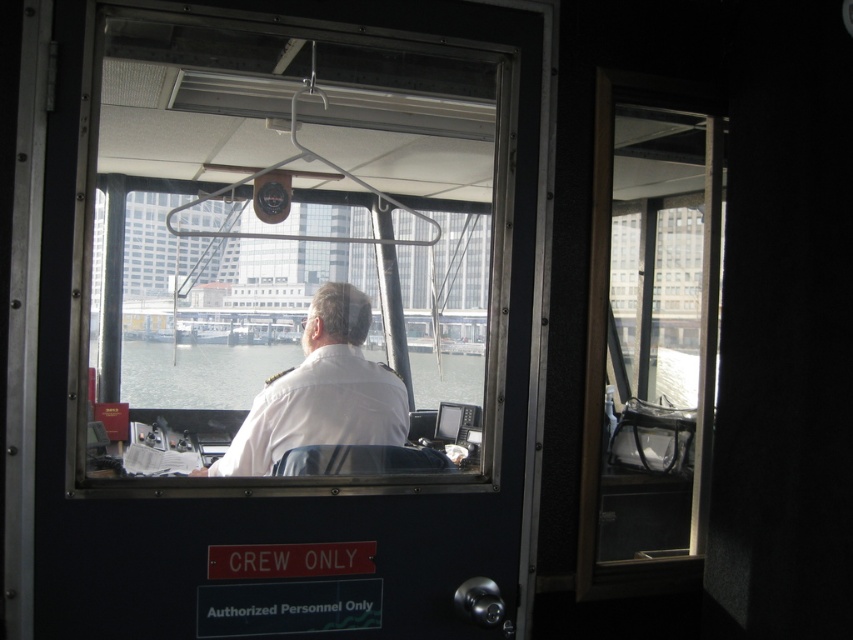
Question: Can you confirm if transparent glass window at upper right is smaller than white uniform at center?

Choices:
 (A) no
 (B) yes

Answer: (B)

Question: Can you confirm if transparent glass window at upper right is thinner than clear water at center?

Choices:
 (A) yes
 (B) no

Answer: (A)

Question: Estimate the real-world distances between objects in this image. Which object is farther from the transparent glass window at upper right?

Choices:
 (A) white uniform at center
 (B) clear water at center

Answer: (B)

Question: Which object appears closest to the camera in this image?

Choices:
 (A) white uniform at center
 (B) clear water at center
 (C) transparent glass window at upper right

Answer: (A)

Question: Which of these objects is positioned closest to the transparent glass window at upper right?

Choices:
 (A) white uniform at center
 (B) clear water at center

Answer: (A)

Question: Is transparent glass window at upper right above white uniform at center?

Choices:
 (A) yes
 (B) no

Answer: (A)